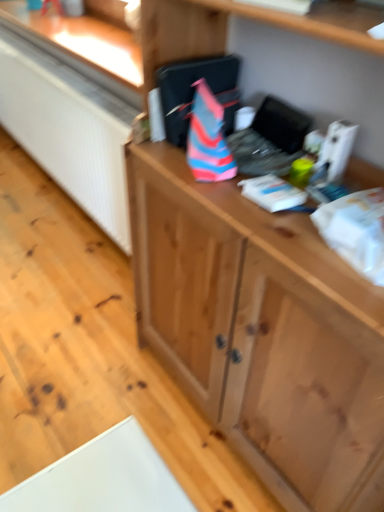
Find the location of a particular element. This screenshot has height=512, width=384. wooden cabinet at center is located at coordinates (261, 332).

The width and height of the screenshot is (384, 512). What do you see at coordinates (261, 332) in the screenshot?
I see `wooden cabinet at center` at bounding box center [261, 332].

Where is `wooden cabinet at center`? wooden cabinet at center is located at coordinates (261, 332).